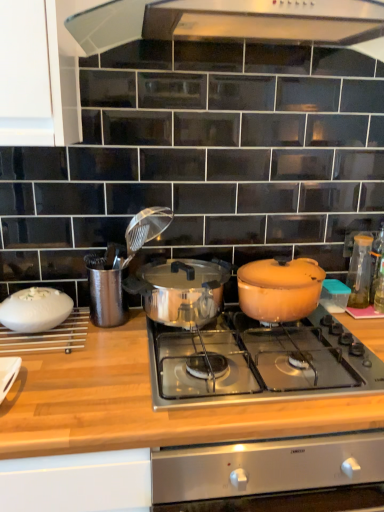
Identify the location of free point below white matte bowl at left, acting as the first kitchen appliance starting from the left (from a real-world perspective). (26, 334).